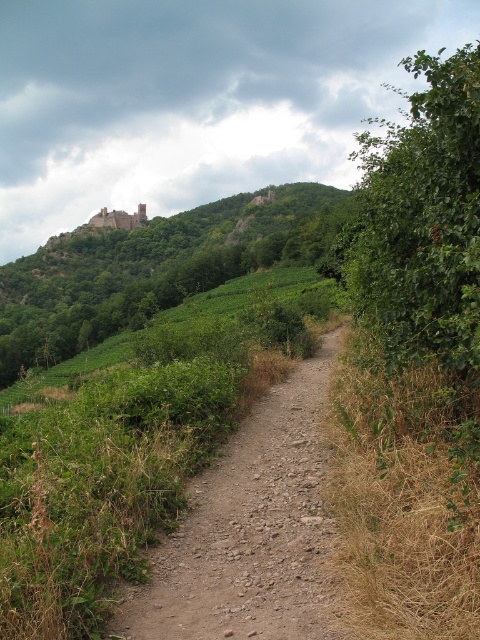
In the scene shown: You are a hiker planning to walk along the dusty gravel path at center and the green leafy hillside at upper left. Which of these two features is lower in elevation?

The dusty gravel path at center has a lesser height compared to the green leafy hillside at upper left, so the dusty gravel path at center is lower in elevation.